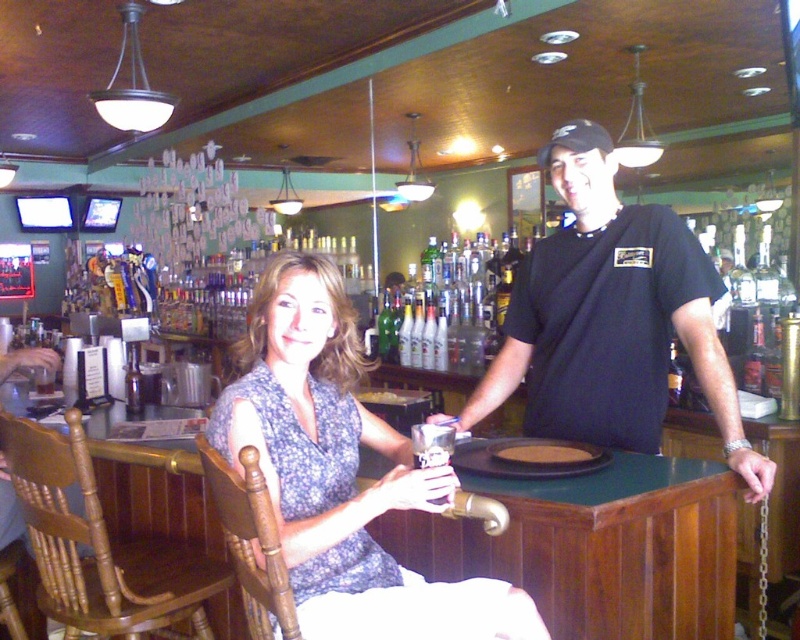
Is floral fabric dress at center shorter than black matte t-shirt at center?

Yes.

Is floral fabric dress at center wider than black matte t-shirt at center?

In fact, floral fabric dress at center might be narrower than black matte t-shirt at center.

At what (x,y) coordinates should I click in order to perform the action: click on floral fabric dress at center. Please return your answer as a coordinate pair (x, y). This screenshot has width=800, height=640. Looking at the image, I should click on (342, 472).